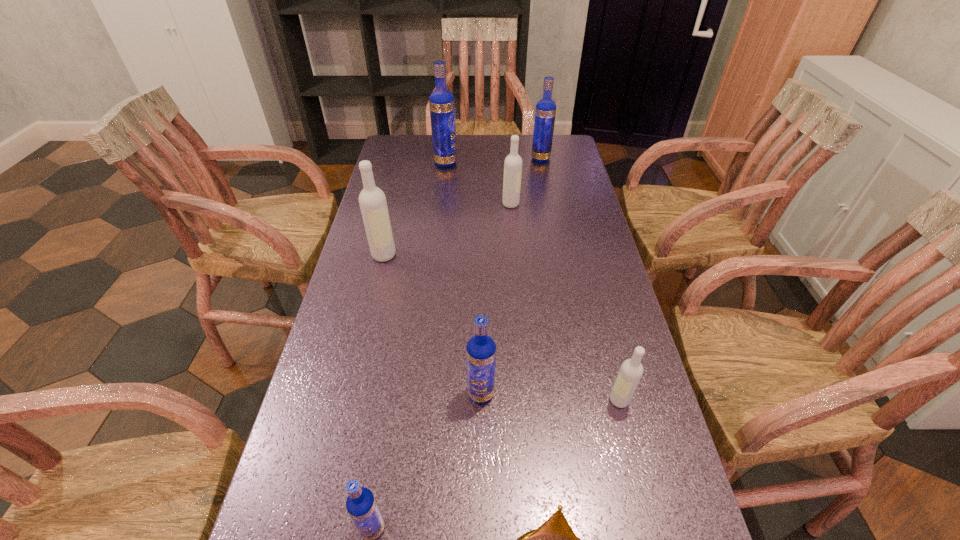
The width and height of the screenshot is (960, 540). Find the location of `the tallest vodka`. the tallest vodka is located at coordinates (441, 101).

This screenshot has height=540, width=960. I want to click on the tallest object, so click(441, 101).

The image size is (960, 540). What are the coordinates of `the sixth vodka from left to right` in the screenshot? It's located at (545, 112).

Where is `the second biggest blue vodka`? the second biggest blue vodka is located at coordinates (545, 112).

The width and height of the screenshot is (960, 540). What are the coordinates of `the leftmost white vodka` in the screenshot? It's located at (372, 200).

The height and width of the screenshot is (540, 960). Identify the location of the fourth farthest vodka. (372, 200).

Find the location of a particular element. Image resolution: width=960 pixels, height=540 pixels. the second white vodka from left to right is located at coordinates pos(513,162).

This screenshot has height=540, width=960. Find the location of `the third farthest vodka`. the third farthest vodka is located at coordinates (513, 162).

Identify the location of the second nearest blue vodka. (481, 349).

Where is `the second blue vodka from right to left`? The image size is (960, 540). the second blue vodka from right to left is located at coordinates (481, 349).